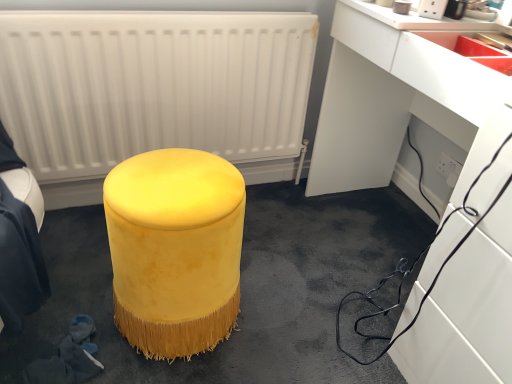
In order to click on white glossy computer desk at lower right in this screenshot , I will do pyautogui.click(x=399, y=101).

Identify the location of velvet yellow ottoman at center. Image resolution: width=512 pixels, height=384 pixels. (175, 249).

At what (x,y) coordinates should I click in order to perform the action: click on white plastic electric outlet at lower right. Please return your answer as a coordinate pair (x, y). This screenshot has height=384, width=512. Looking at the image, I should click on (448, 169).

Identify the location of velvet yellow stool at center. (241, 290).

In the image, is velvet yellow ottoman at center on the left side or the right side of white glossy computer desk at lower right?

velvet yellow ottoman at center is to the left of white glossy computer desk at lower right.

From a real-world perspective, between velvet yellow ottoman at center and white glossy computer desk at lower right, who is vertically higher?

white glossy computer desk at lower right.

Which of these two, velvet yellow ottoman at center or white glossy computer desk at lower right, stands shorter?

velvet yellow ottoman at center.

Does velvet yellow ottoman at center have a larger size compared to white glossy computer desk at lower right?

Incorrect, velvet yellow ottoman at center is not larger than white glossy computer desk at lower right.

Based on the photo, can you tell me how much velvet yellow ottoman at center and velvet yellow stool at center differ in facing direction?

The angle between the facing direction of velvet yellow ottoman at center and the facing direction of velvet yellow stool at center is 1.53 degrees.

Consider the image. Which object is wider, velvet yellow ottoman at center or velvet yellow stool at center?

velvet yellow stool at center.

Which object is positioned more to the right, velvet yellow ottoman at center or velvet yellow stool at center?

From the viewer's perspective, velvet yellow stool at center appears more on the right side.

In the scene shown: Which is closer to the camera, (111, 220) or (111, 350)?

Point (111, 220) is positioned closer to the camera compared to point (111, 350).

Consider the image. From a real-world perspective, is velvet yellow ottoman at center on top of matte red sink at upper right?

No.

Considering the sizes of objects velvet yellow ottoman at center and matte red sink at upper right in the image provided, who is smaller, velvet yellow ottoman at center or matte red sink at upper right?

matte red sink at upper right.

Is velvet yellow ottoman at center wider or thinner than matte red sink at upper right?

Considering their sizes, velvet yellow ottoman at center looks slimmer than matte red sink at upper right.

Is the surface of white glossy computer desk at lower right in direct contact with velvet yellow ottoman at center?

No, white glossy computer desk at lower right is not next to velvet yellow ottoman at center.

Is white glossy computer desk at lower right outside of velvet yellow ottoman at center?

white glossy computer desk at lower right lies outside velvet yellow ottoman at center's area.

In terms of width, does white glossy computer desk at lower right look wider or thinner when compared to velvet yellow ottoman at center?

Clearly, white glossy computer desk at lower right has more width compared to velvet yellow ottoman at center.

Considering the relative positions of white glossy computer desk at lower right and velvet yellow ottoman at center in the image provided, is white glossy computer desk at lower right to the right of velvet yellow ottoman at center from the viewer's perspective?

Yes, white glossy computer desk at lower right is to the right of velvet yellow ottoman at center.

Does point (201, 13) lie in front of point (151, 182)?

That is False.

From a real-world perspective, is white matte radiator at upper center positioned under velvet yellow ottoman at center based on gravity?

No, from a real-world perspective, white matte radiator at upper center is not below velvet yellow ottoman at center.

From the image's perspective, between white matte radiator at upper center and velvet yellow ottoman at center, which one is located above?

white matte radiator at upper center appears higher in the image.

Is there a large distance between white matte radiator at upper center and velvet yellow ottoman at center?

No, white matte radiator at upper center is in close proximity to velvet yellow ottoman at center.

At what (x,y) coordinates should I click in order to perform the action: click on sink lying behind the velvet yellow stool at center. Please return your answer as a coordinate pair (x, y). Looking at the image, I should click on (471, 50).

Consider the image. Does matte red sink at upper right have a larger size compared to velvet yellow stool at center?

Actually, matte red sink at upper right might be smaller than velvet yellow stool at center.

Considering the sizes of objects matte red sink at upper right and velvet yellow stool at center in the image provided, who is wider, matte red sink at upper right or velvet yellow stool at center?

velvet yellow stool at center.

Considering the sizes of objects velvet yellow stool at center and white matte radiator at upper center in the image provided, who is shorter, velvet yellow stool at center or white matte radiator at upper center?

Standing shorter between the two is velvet yellow stool at center.

Could you tell me if velvet yellow stool at center is facing white matte radiator at upper center?

No, velvet yellow stool at center is not turned towards white matte radiator at upper center.

Based on the photo, is velvet yellow stool at center in front of or behind white matte radiator at upper center in the image?

velvet yellow stool at center is positioned closer to the viewer than white matte radiator at upper center.

Between velvet yellow stool at center and white matte radiator at upper center, which one appears on the left side from the viewer's perspective?

Positioned to the left is white matte radiator at upper center.

The image size is (512, 384). Find the location of `computer desk located in front of the velvet yellow ottoman at center`. computer desk located in front of the velvet yellow ottoman at center is located at coordinates (399, 101).

This screenshot has width=512, height=384. I want to click on concrete on the right of velvet yellow ottoman at center, so click(x=241, y=290).

Which object lies further to the anchor point white matte radiator at upper center, velvet yellow ottoman at center or matte red sink at upper right?

matte red sink at upper right.

When comparing their distances from velvet yellow ottoman at center, does white glossy computer desk at lower right or white plastic electric outlet at lower right seem further?

white plastic electric outlet at lower right is further to velvet yellow ottoman at center.

Which object lies nearer to the anchor point matte red sink at upper right, white glossy computer desk at lower right or velvet yellow stool at center?

white glossy computer desk at lower right is positioned closer to the anchor matte red sink at upper right.

Considering their positions, is velvet yellow ottoman at center positioned further to velvet yellow stool at center than white matte radiator at upper center?

Based on the image, white matte radiator at upper center appears to be further to velvet yellow stool at center.

When comparing their distances from white matte radiator at upper center, does white glossy computer desk at lower right or matte red sink at upper right seem further?

matte red sink at upper right is further to white matte radiator at upper center.

Considering their positions, is matte red sink at upper right positioned further to white plastic electric outlet at lower right than velvet yellow ottoman at center?

velvet yellow ottoman at center lies further to white plastic electric outlet at lower right than the other object.

From the image, which object appears to be farther from matte red sink at upper right, white matte radiator at upper center or velvet yellow stool at center?

Among the two, velvet yellow stool at center is located further to matte red sink at upper right.

Looking at the image, which one is located further to white matte radiator at upper center, white glossy computer desk at lower right or velvet yellow ottoman at center?

velvet yellow ottoman at center lies further to white matte radiator at upper center than the other object.

Locate an element on the screen. furniture situated between white matte radiator at upper center and white plastic electric outlet at lower right from left to right is located at coordinates 175,249.

Where is `computer desk between white matte radiator at upper center and matte red sink at upper right`? This screenshot has height=384, width=512. computer desk between white matte radiator at upper center and matte red sink at upper right is located at coordinates (399, 101).

At what (x,y) coordinates should I click in order to perform the action: click on concrete located between velvet yellow ottoman at center and white plastic electric outlet at lower right in the left-right direction. Please return your answer as a coordinate pair (x, y). This screenshot has height=384, width=512. Looking at the image, I should click on (241, 290).

At what (x,y) coordinates should I click in order to perform the action: click on concrete between velvet yellow ottoman at center and matte red sink at upper right in the horizontal direction. Please return your answer as a coordinate pair (x, y). The width and height of the screenshot is (512, 384). Looking at the image, I should click on (241, 290).